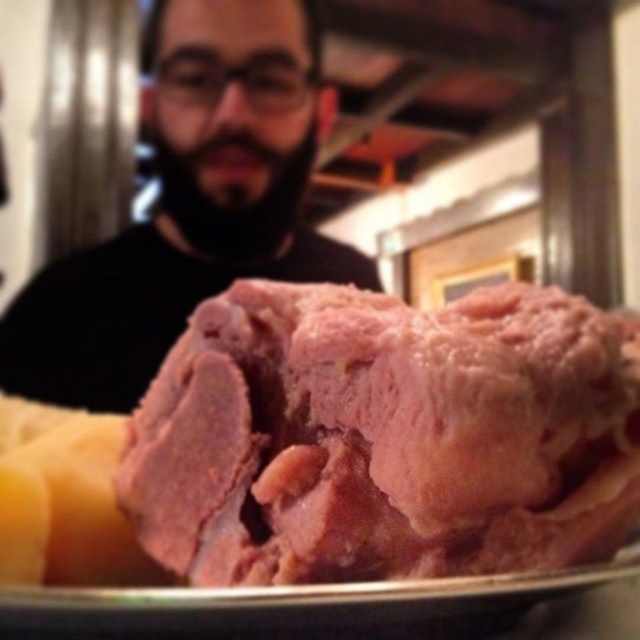
Question: Is pink raw meat at center to the left of bearded man at upper left from the viewer's perspective?

Choices:
 (A) no
 (B) yes

Answer: (A)

Question: Does pink raw meat at center appear over bearded man at upper left?

Choices:
 (A) no
 (B) yes

Answer: (A)

Question: Which of the following is the farthest from the observer?

Choices:
 (A) pink raw meat at center
 (B) bearded man at upper left

Answer: (B)

Question: Is pink raw meat at center below bearded man at upper left?

Choices:
 (A) no
 (B) yes

Answer: (B)

Question: Which object is closer to the camera taking this photo?

Choices:
 (A) pink raw meat at center
 (B) bearded man at upper left

Answer: (A)

Question: Which point is farther from the camera taking this photo?

Choices:
 (A) (116, 314)
 (B) (289, 572)

Answer: (A)